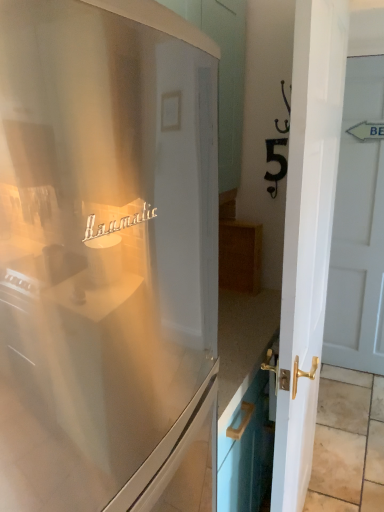
Question: Is white glossy door at right, which appears as the 1th door when viewed from the back, taller or shorter than satin white refrigerator at center?

Choices:
 (A) short
 (B) tall

Answer: (B)

Question: Is white glossy door at right, which is the 2th door from front to back, spatially inside satin white refrigerator at center, or outside of it?

Choices:
 (A) outside
 (B) inside

Answer: (A)

Question: Estimate the real-world distances between objects in this image. Which object is farther from the satin white refrigerator at center?

Choices:
 (A) white glossy door at right, acting as the second door starting from the left
 (B) white glossy door at right, which is the 2th door from back to front

Answer: (A)

Question: Estimate the real-world distances between objects in this image. Which object is farther from the white glossy door at right, which is counted as the first door, starting from the left?

Choices:
 (A) white glossy door at right, acting as the second door starting from the left
 (B) satin white refrigerator at center

Answer: (A)